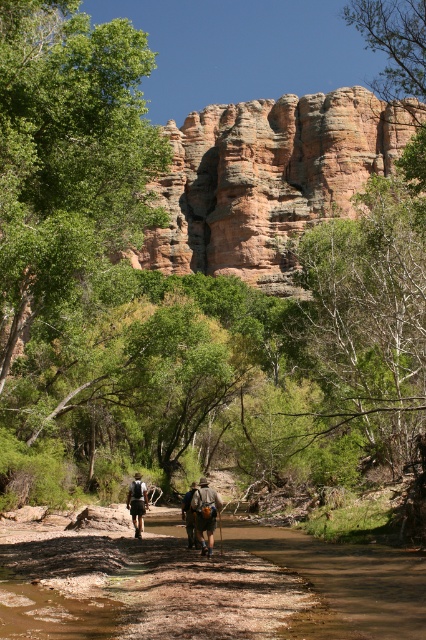
Is brown leather horse at center shorter than matte black backpack at center?

No, brown leather horse at center is not shorter than matte black backpack at center.

Which is behind, point (204, 496) or point (129, 492)?

The point (129, 492) is behind.

This screenshot has width=426, height=640. Identify the location of brown leather horse at center. (204, 513).

Does rustic sandstone cliff at center have a lesser width compared to matte black backpack at center?

In fact, rustic sandstone cliff at center might be wider than matte black backpack at center.

Who is higher up, rustic sandstone cliff at center or matte black backpack at center?

rustic sandstone cliff at center

Describe the element at coordinates (267, 179) in the screenshot. The height and width of the screenshot is (640, 426). I see `rustic sandstone cliff at center` at that location.

The width and height of the screenshot is (426, 640). Identify the location of rustic sandstone cliff at center. (267, 179).

Who is positioned more to the left, rustic sandstone cliff at center or dark brown leather backpack at center?

dark brown leather backpack at center

Can you confirm if rustic sandstone cliff at center is taller than dark brown leather backpack at center?

Correct, rustic sandstone cliff at center is much taller as dark brown leather backpack at center.

In the scene shown: Measure the distance between point (302, 104) and camera.

Point (302, 104) is 151.92 meters from camera.

Where is `rustic sandstone cliff at center`? The width and height of the screenshot is (426, 640). rustic sandstone cliff at center is located at coordinates (267, 179).